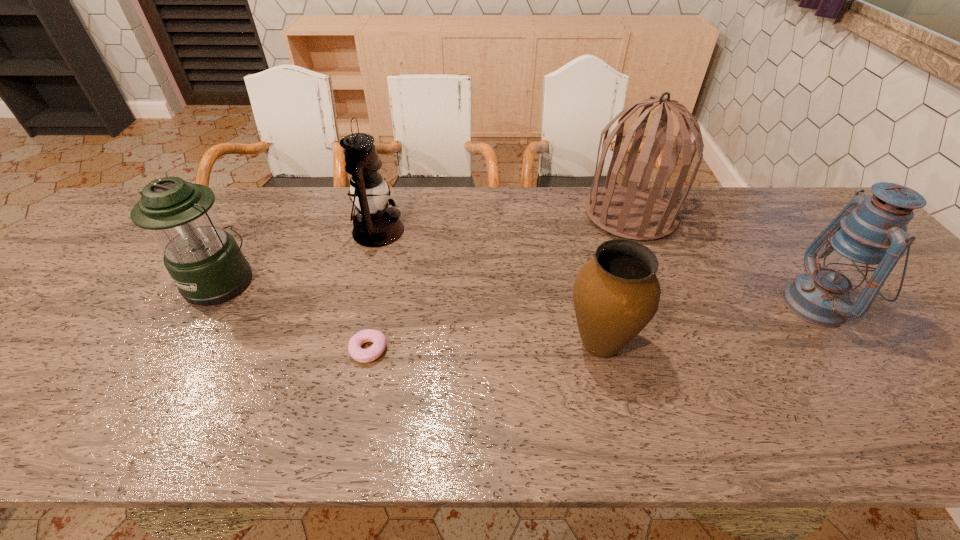
Where is `birdcage`? This screenshot has height=540, width=960. birdcage is located at coordinates coord(628,211).

The width and height of the screenshot is (960, 540). I want to click on the farthest lantern, so click(x=375, y=225).

This screenshot has width=960, height=540. I want to click on the rightmost lantern, so click(868, 236).

Identify the location of the leftmost object. The image size is (960, 540). (205, 262).

Identify the location of urn. Image resolution: width=960 pixels, height=540 pixels. (616, 294).

Image resolution: width=960 pixels, height=540 pixels. Identify the location of the shortest object. (378, 339).

Where is `vacant area situated on the left of the birdcage`? Image resolution: width=960 pixels, height=540 pixels. vacant area situated on the left of the birdcage is located at coordinates (562, 214).

Identify the location of vacant space located 0.340m on the side of the farthest lantern, there is a wick adjustment knob. (520, 231).

Where is `free space located 0.390m on the front-facing side of the rightmost object`? The height and width of the screenshot is (540, 960). free space located 0.390m on the front-facing side of the rightmost object is located at coordinates (627, 305).

The height and width of the screenshot is (540, 960). Identify the location of free space located 0.300m on the front-facing side of the rightmost object. (663, 305).